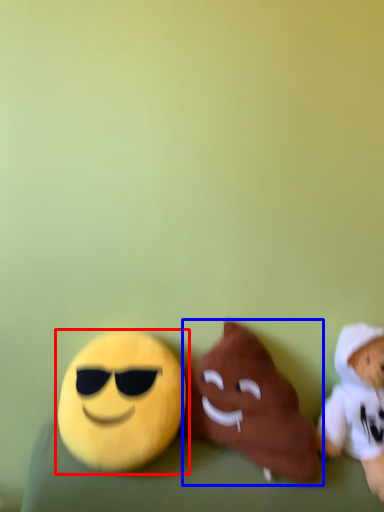
Question: Which point is closer to the camera, toy (highlighted by a red box) or toy (highlighted by a blue box)?

Choices:
 (A) toy
 (B) toy

Answer: (B)